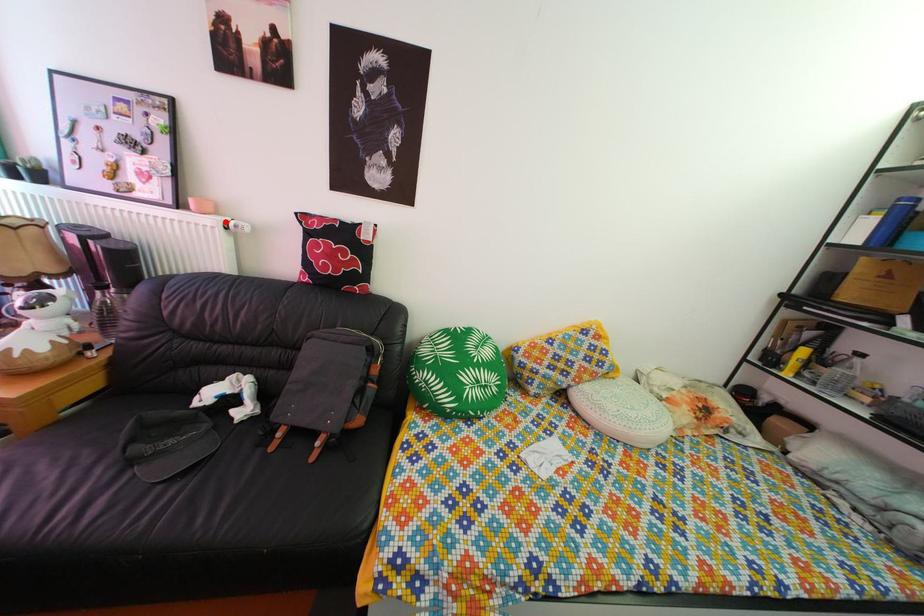
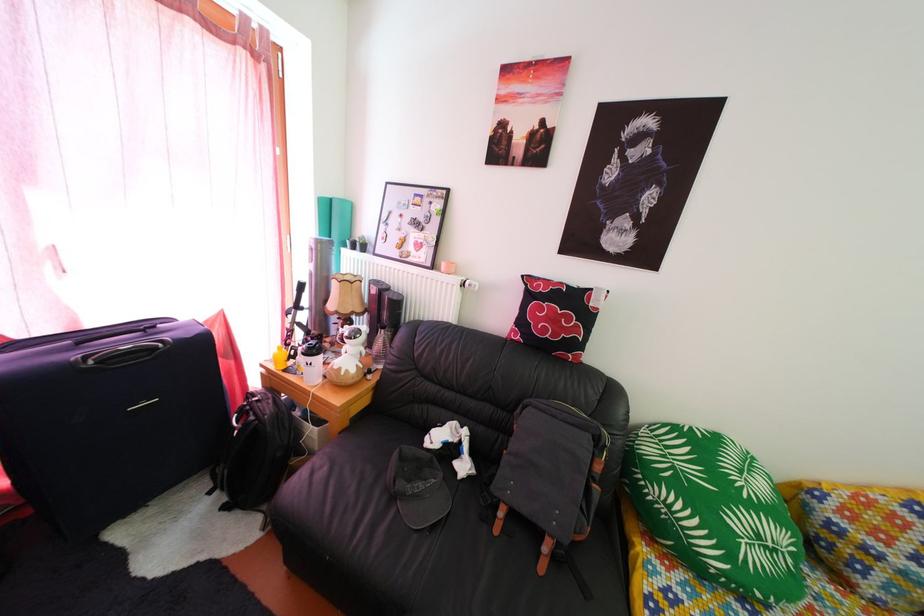
Where in the second image is the point corresponding to the highlighted location from the first image?

(464, 282)